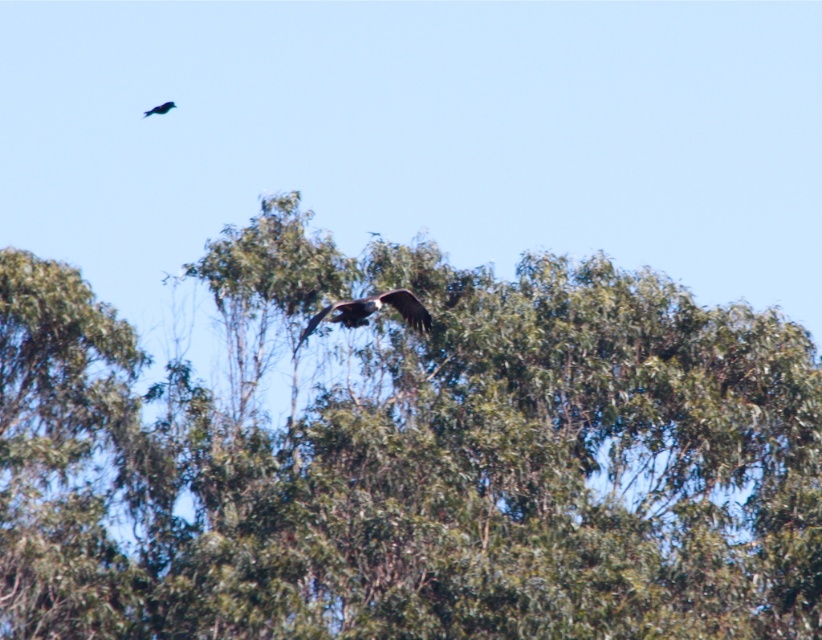
Between point (423, 326) and point (156, 109), which one is positioned behind?

The point (156, 109) is more distant.

Can you confirm if brown feathered eagle at center is bigger than shiny black bird at upper left?

Indeed, brown feathered eagle at center has a larger size compared to shiny black bird at upper left.

You are a GUI agent. You are given a task and a screenshot of the screen. Output one action in this format:
    pyautogui.click(x=<x>, y=<y>)
    Task: Click on the brown feathered eagle at center
    
    Given the screenshot: What is the action you would take?
    pyautogui.click(x=372, y=310)

The height and width of the screenshot is (640, 822). Describe the element at coordinates (407, 456) in the screenshot. I see `green leafy tree at center` at that location.

Who is lower down, green leafy tree at center or brown feathered eagle at center?

green leafy tree at center is lower down.

Measure the distance between green leafy tree at center and camera.

green leafy tree at center and camera are 399.37 feet apart from each other.

What are the coordinates of `green leafy tree at center` in the screenshot? It's located at (407, 456).

Can you confirm if green leafy tree at center is positioned to the right of shiny black bird at upper left?

Indeed, green leafy tree at center is positioned on the right side of shiny black bird at upper left.

Does point (774, 556) come in front of point (164, 113)?

Yes.

Find the location of a particular element. green leafy tree at center is located at coordinates (407, 456).

Where is `green leafy tree at center`? green leafy tree at center is located at coordinates (407, 456).